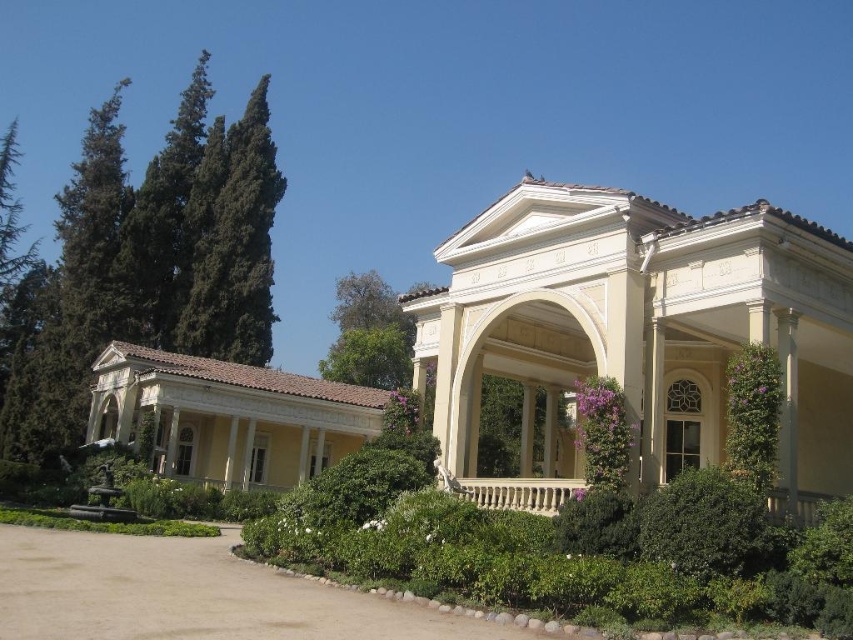
Is the position of brown gravel driveway at lower center more distant than that of green leafy bush at right?

No, brown gravel driveway at lower center is in front of green leafy bush at right.

Does brown gravel driveway at lower center have a lesser width compared to green leafy bush at right?

Incorrect, brown gravel driveway at lower center's width is not less than green leafy bush at right's.

Does point (242, 563) lie in front of point (732, 445)?

No, (242, 563) is behind (732, 445).

Where is `brown gravel driveway at lower center`? brown gravel driveway at lower center is located at coordinates (192, 595).

Can you confirm if beige stucco gazebo at center is positioned to the left of white marble porch at center?

No, beige stucco gazebo at center is not to the left of white marble porch at center.

Between point (514, 198) and point (802, 520), which one is positioned behind?

Positioned behind is point (514, 198).

Where is `beige stucco gazebo at center`? beige stucco gazebo at center is located at coordinates (639, 332).

Which of these two, green leafy bush at right or white marble porch at center, stands taller?

Standing taller between the two is white marble porch at center.

Between point (730, 362) and point (554, 508), which one is positioned in front?

Positioned in front is point (730, 362).

Find the location of `green leafy bush at right`. green leafy bush at right is located at coordinates (752, 416).